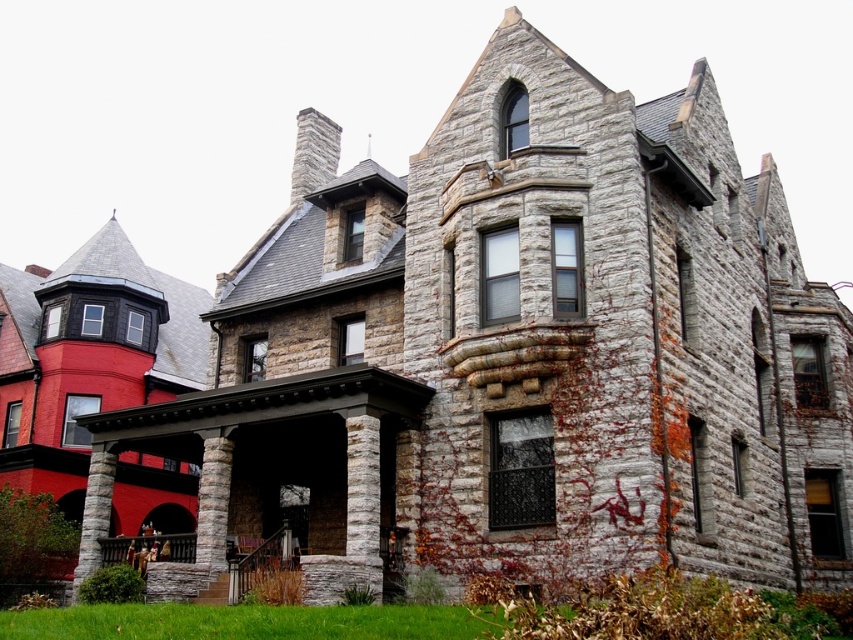
Question: Can you confirm if stone porch at lower center is positioned above gray stone column at lower left?

Choices:
 (A) yes
 (B) no

Answer: (B)

Question: Among these points, which one is farthest from the camera?

Choices:
 (A) (282, 528)
 (B) (213, 550)
 (C) (91, 554)

Answer: (C)

Question: Considering the relative positions of stone porch at lower center and stone textured column at center in the image provided, where is stone porch at lower center located with respect to stone textured column at center?

Choices:
 (A) right
 (B) left

Answer: (A)

Question: Can you confirm if stone porch at lower center is bigger than stone textured column at center?

Choices:
 (A) no
 (B) yes

Answer: (A)

Question: Which point is farther from the camera taking this photo?

Choices:
 (A) (120, 545)
 (B) (97, 564)

Answer: (A)

Question: Which of the following is the closest to the observer?

Choices:
 (A) gray stone column at lower left
 (B) stone porch at lower center
 (C) stone textured column at center

Answer: (B)